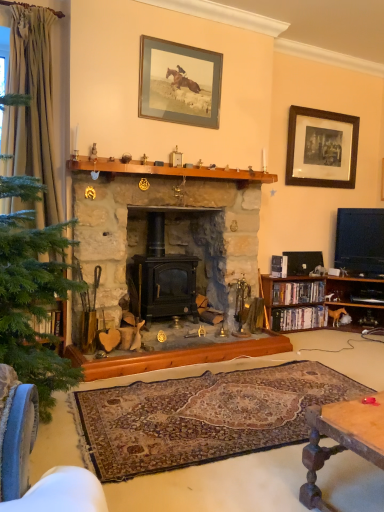
The height and width of the screenshot is (512, 384). I want to click on free space below flat screen tv at right (from a real-world perspective), so click(x=359, y=278).